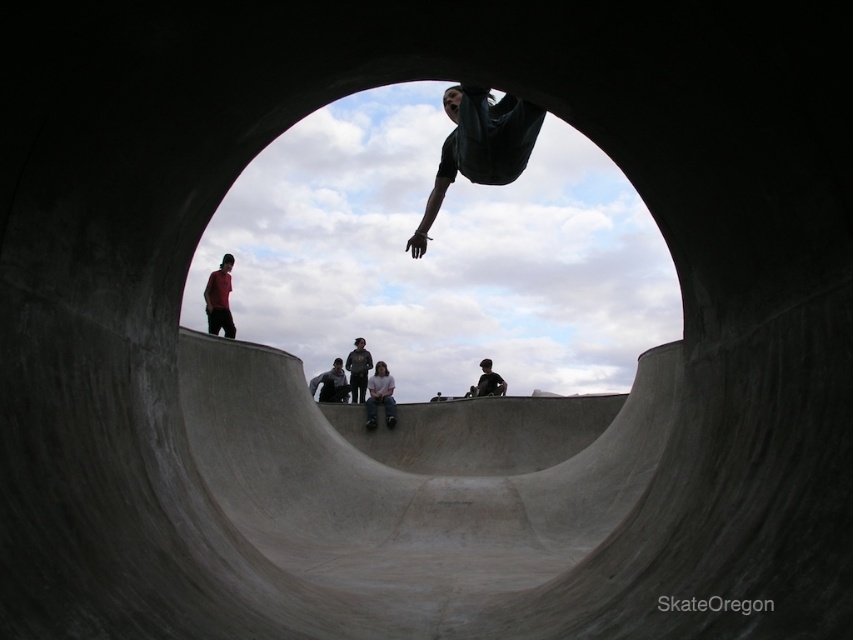
Which is in front, point (497, 385) or point (389, 420)?

Positioned in front is point (389, 420).

Can you confirm if dark gray concrete skateboarder at center is positioned to the left of black rubber skateboard at center?

In fact, dark gray concrete skateboarder at center is to the right of black rubber skateboard at center.

Locate an element on the screen. dark gray concrete skateboarder at center is located at coordinates (486, 381).

The width and height of the screenshot is (853, 640). I want to click on dark gray concrete skateboarder at center, so click(x=486, y=381).

You are a GUI agent. You are given a task and a screenshot of the screen. Output one action in this format:
    pyautogui.click(x=<x>, y=<y>)
    Task: Click on the red shirt at upper left
    The image size is (853, 640).
    Given the screenshot: What is the action you would take?
    pyautogui.click(x=219, y=298)

Is point (213, 314) positioned in front of point (479, 392)?

Yes, it is.

Find the location of a particular element. red shirt at upper left is located at coordinates (219, 298).

Which is above, light gray jeans at center or dark gray concrete skateboarder at center?

Positioned higher is dark gray concrete skateboarder at center.

Is point (375, 413) farther from viewer compared to point (486, 368)?

No, (375, 413) is closer to viewer.

What do you see at coordinates (380, 396) in the screenshot? I see `light gray jeans at center` at bounding box center [380, 396].

Find the location of a particular element. light gray jeans at center is located at coordinates (380, 396).